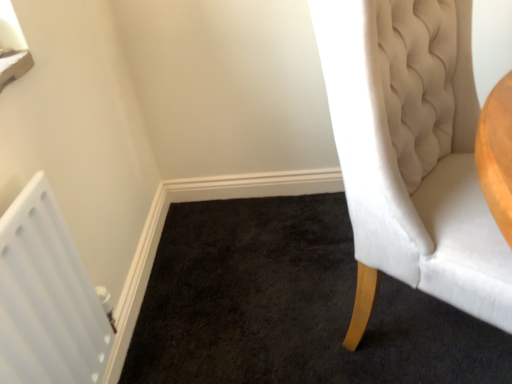
Question: Is white plastic radiator at lower left wider or thinner than white velvet chair at right?

Choices:
 (A) wide
 (B) thin

Answer: (B)

Question: Which is correct: white plastic radiator at lower left is inside white velvet chair at right, or outside of it?

Choices:
 (A) outside
 (B) inside

Answer: (A)

Question: Is white plastic radiator at lower left to the left or to the right of white velvet chair at right in the image?

Choices:
 (A) left
 (B) right

Answer: (A)

Question: Do you think white velvet chair at right is within white plastic radiator at lower left, or outside of it?

Choices:
 (A) outside
 (B) inside

Answer: (A)

Question: From the image's perspective, is white velvet chair at right above or below white plastic radiator at lower left?

Choices:
 (A) below
 (B) above

Answer: (B)

Question: Considering the positions of white velvet chair at right and white plastic radiator at lower left in the image, is white velvet chair at right bigger or smaller than white plastic radiator at lower left?

Choices:
 (A) small
 (B) big

Answer: (B)

Question: From a real-world perspective, relative to white plastic radiator at lower left, is white velvet chair at right vertically above or below?

Choices:
 (A) below
 (B) above

Answer: (B)